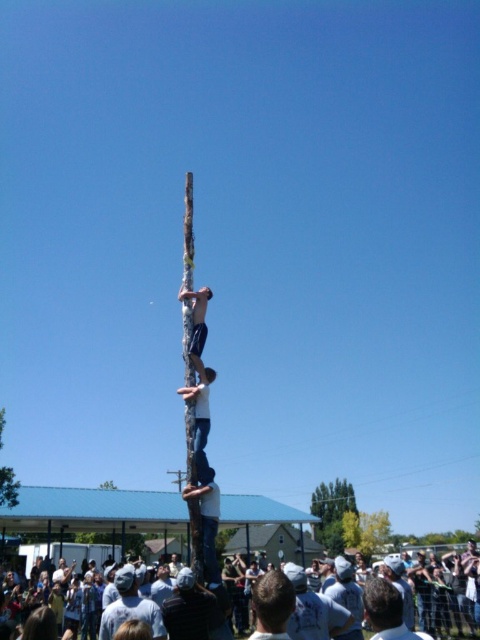
You are organizing a photo shoot and need to position a camera to capture both the white cotton crowd at lower center and the dark gray shirt at lower center in the same frame. Given their sizes, which object should you focus on first to ensure both fit in the shot?

Since the white cotton crowd at lower center is wider than the dark gray shirt at lower center, you should focus on positioning the camera to include the wider white cotton crowd at lower center first, ensuring there is enough space for the smaller dark gray shirt at lower center in the frame.

You are a photographer positioned behind the temporary fence at the event. You want to take a photo of the dark gray shirt at lower center but the white cotton crowd at lower center is blocking your view. Can you move to the side to get a clear shot?

The white cotton crowd at lower center is in front of the dark gray shirt at lower center, so moving to the side might allow you to see around the crowd and capture the dark gray shirt at lower center in your photo.